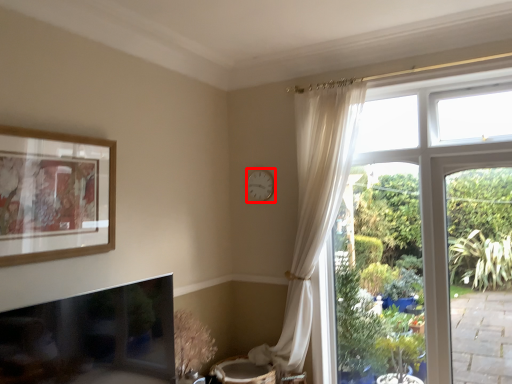
Question: Observing the image, what is the correct spatial positioning of clock (annotated by the red box) in reference to picture frame?

Choices:
 (A) right
 (B) left

Answer: (A)